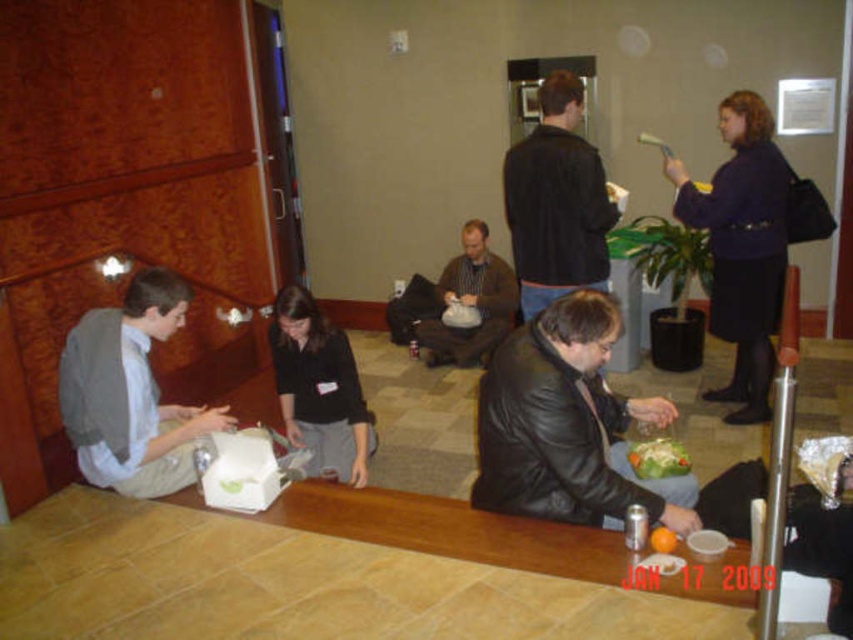
Can you confirm if leather jacket at lower center is positioned to the right of purple woolen sweater at upper right?

In fact, leather jacket at lower center is to the left of purple woolen sweater at upper right.

Who is more distant from viewer, (593, 444) or (756, 358)?

Positioned behind is point (756, 358).

This screenshot has width=853, height=640. I want to click on leather jacket at lower center, so click(x=567, y=426).

Which of these two, purple woolen sweater at upper right or black leather jacket at upper center, stands shorter?

With less height is black leather jacket at upper center.

Who is lower down, purple woolen sweater at upper right or black leather jacket at upper center?

purple woolen sweater at upper right is lower down.

Is point (717, 308) positioned behind point (614, 204)?

Yes.

The image size is (853, 640). I want to click on purple woolen sweater at upper right, so click(741, 246).

Can you confirm if black leather jacket at upper center is shorter than black matte shirt at center?

No, black leather jacket at upper center is not shorter than black matte shirt at center.

Is black leather jacket at upper center smaller than black matte shirt at center?

Yes.

Between point (548, 150) and point (281, 369), which one is positioned behind?

Positioned behind is point (281, 369).

Identify the location of black leather jacket at upper center. (556, 202).